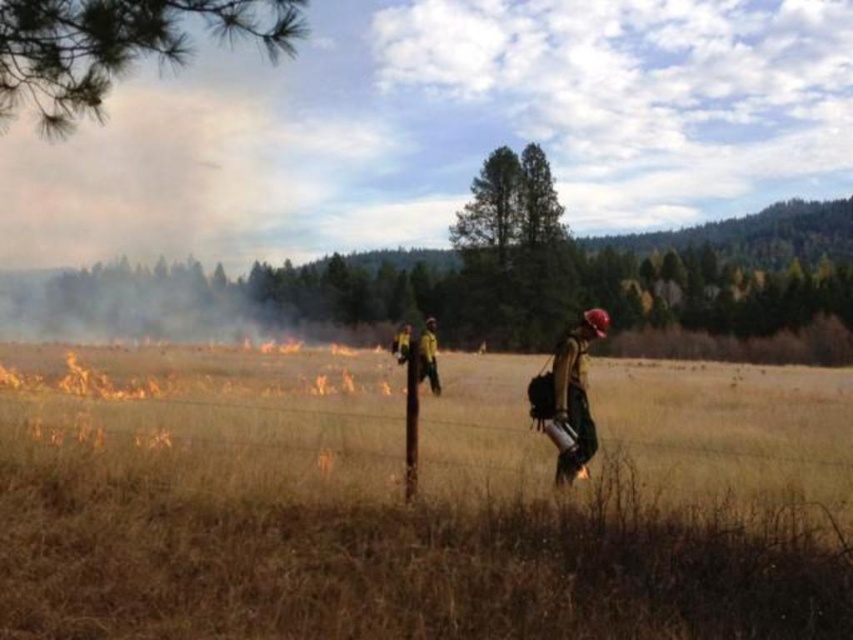
Question: Considering the real-world distances, which object is farthest from the brown dry grass at center?

Choices:
 (A) yellow reflective vest at center
 (B) matte brown helmet at right

Answer: (B)

Question: Does brown dry grass at center have a lesser width compared to matte brown helmet at right?

Choices:
 (A) no
 (B) yes

Answer: (A)

Question: Can you confirm if brown dry grass at center is positioned to the right of matte brown helmet at right?

Choices:
 (A) no
 (B) yes

Answer: (B)

Question: Which point is farther to the camera?

Choices:
 (A) (683, 368)
 (B) (399, 356)
 (C) (418, 365)
 (D) (573, 412)

Answer: (A)

Question: Which object is positioned closest to the brown dry grass at center?

Choices:
 (A) yellow-green uniform at center
 (B) matte brown helmet at right
 (C) yellow reflective vest at center

Answer: (A)

Question: Does brown dry grass at center have a greater width compared to yellow reflective vest at center?

Choices:
 (A) yes
 (B) no

Answer: (A)